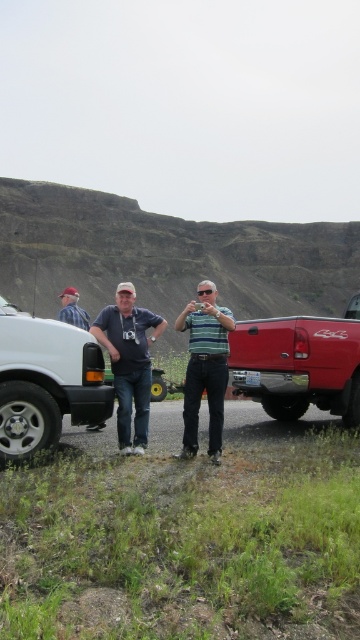
Question: Does white matte van at left appear on the right side of striped cotton shirt at center?

Choices:
 (A) yes
 (B) no

Answer: (B)

Question: Does shiny red truck at right have a greater width compared to brushed metal cap at left?

Choices:
 (A) yes
 (B) no

Answer: (B)

Question: Can you confirm if matte blue shirt at center is thinner than brushed metal cap at left?

Choices:
 (A) no
 (B) yes

Answer: (B)

Question: Which object is closer to the camera taking this photo?

Choices:
 (A) brushed metal cap at left
 (B) shiny red truck at right
 (C) matte blue shirt at center

Answer: (C)

Question: Which point is closer to the camera taking this photo?

Choices:
 (A) (280, 390)
 (B) (75, 374)
 (C) (146, 442)

Answer: (B)

Question: Which point is farther to the camera?

Choices:
 (A) shiny red truck at right
 (B) matte black camera at center

Answer: (A)